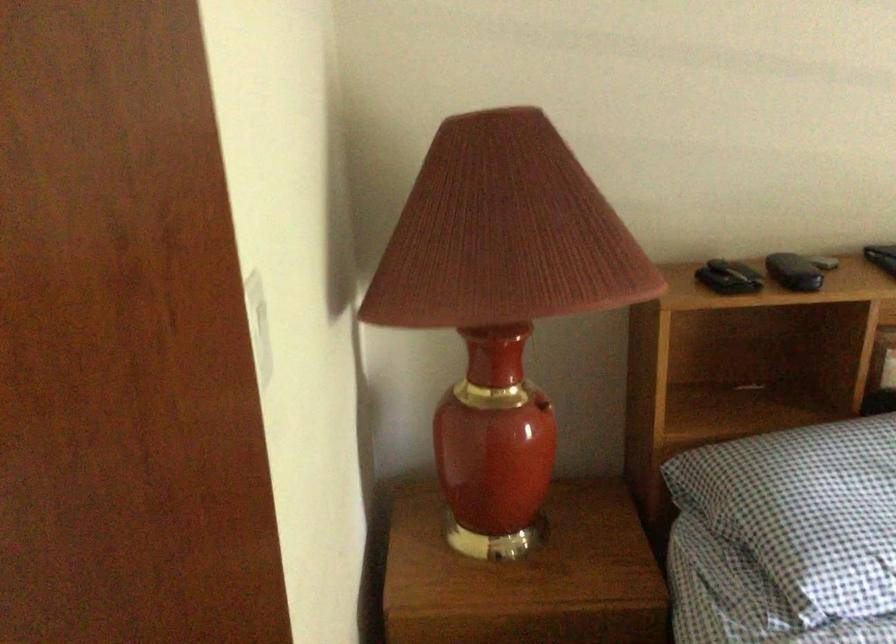
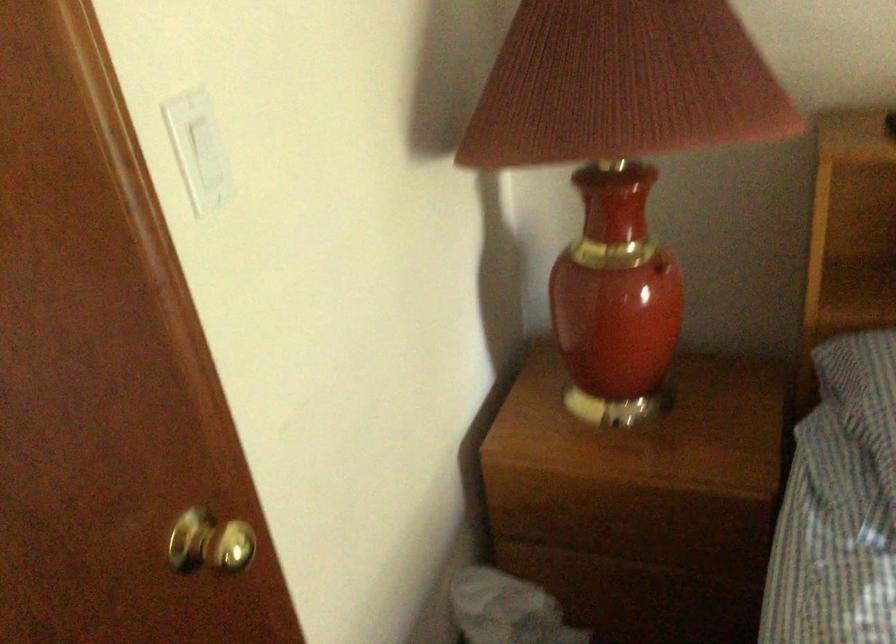
Where in the second image is the point corresponding to [245,310] from the first image?

(197, 149)